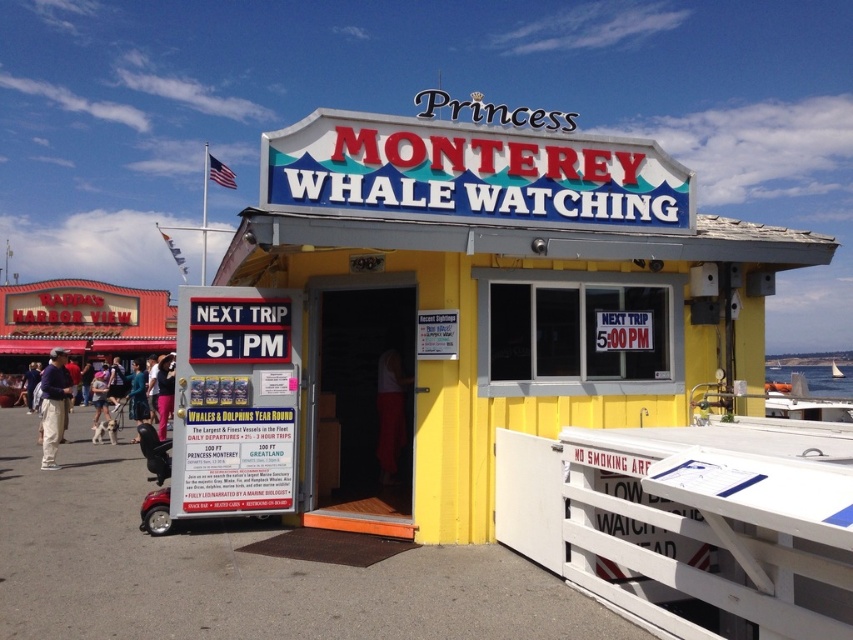
Does light brown leather jacket at lower left have a smaller size compared to blue denim jeans at center?

Actually, light brown leather jacket at lower left might be larger than blue denim jeans at center.

Describe the element at coordinates (53, 404) in the screenshot. I see `light brown leather jacket at lower left` at that location.

Identify the location of light brown leather jacket at lower left. (53, 404).

Does yellow woodshed at center appear over blue denim jeans at center?

Indeed, yellow woodshed at center is positioned over blue denim jeans at center.

Which of these two, yellow woodshed at center or blue denim jeans at center, stands shorter?

With less height is blue denim jeans at center.

Who is more forward, (259, 204) or (146, 400)?

Point (259, 204)

What are the coordinates of `yellow woodshed at center` in the screenshot? It's located at (476, 301).

Can you confirm if dark blue sweater at left is positioned to the left of blue denim jeans at center?

Yes, dark blue sweater at left is to the left of blue denim jeans at center.

Is dark blue sweater at left positioned at the back of blue denim jeans at center?

That is False.

What are the coordinates of `dark blue sweater at left` in the screenshot? It's located at (53, 404).